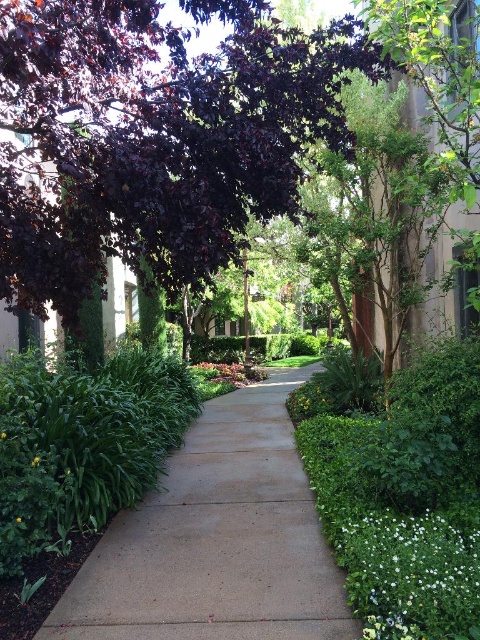
Question: Which object appears closest to the camera in this image?

Choices:
 (A) purple glossy leaves at upper left
 (B) white matte flower at lower right
 (C) sandy concrete sidewalk at center

Answer: (B)

Question: Which point is closer to the camera?

Choices:
 (A) sandy concrete sidewalk at center
 (B) green leafy plant at lower left
 (C) white matte flower at lower right
 (D) purple glossy leaves at upper left

Answer: (C)

Question: Is the position of sandy concrete sidewalk at center less distant than that of green leafy bush at center-left?

Choices:
 (A) yes
 (B) no

Answer: (A)

Question: Does purple glossy leaves at upper left appear under green leafy plant at lower left?

Choices:
 (A) yes
 (B) no

Answer: (B)

Question: Which of the following is the farthest from the observer?

Choices:
 (A) purple glossy leaves at upper left
 (B) sandy concrete sidewalk at center

Answer: (A)

Question: Is purple glossy leaves at upper left below sandy concrete sidewalk at center?

Choices:
 (A) yes
 (B) no

Answer: (B)